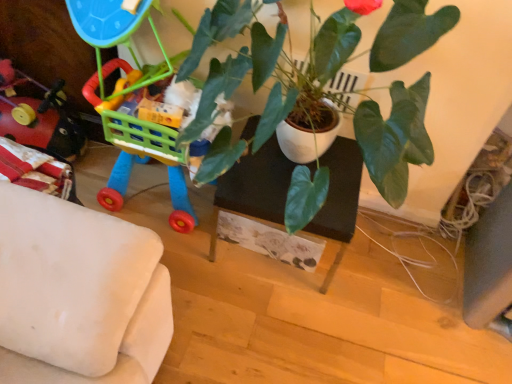
Locate an element on the screen. This screenshot has height=384, width=512. vacant space in front of black matte table at center is located at coordinates (267, 324).